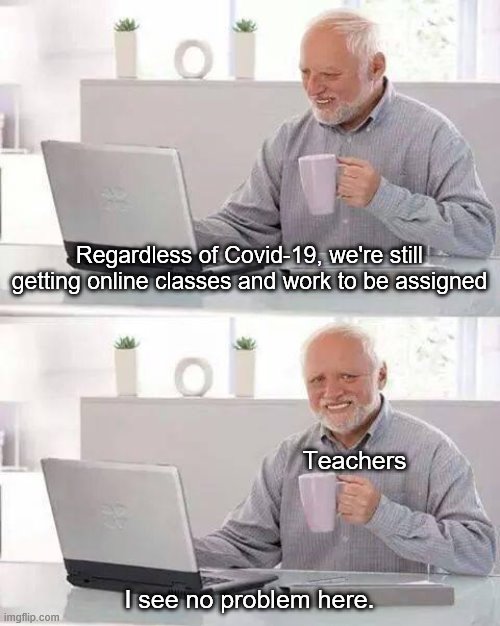
You are a GUI agent. You are given a task and a screenshot of the screen. Output one action in this format:
    pyautogui.click(x=<x>, y=<y>)
    Task: Click on the coffee mug
    The height and width of the screenshot is (626, 500).
    Given the screenshot: What is the action you would take?
    324,501, 315,193